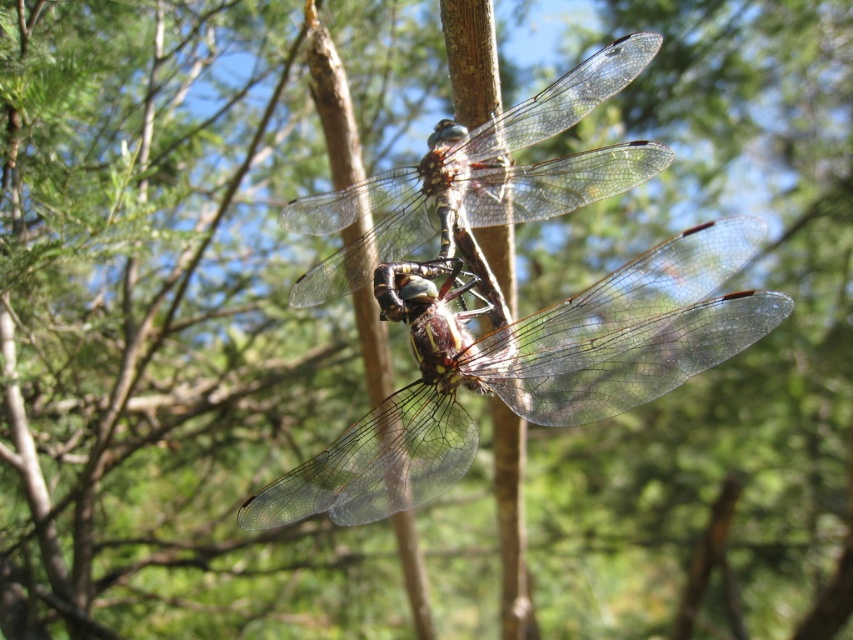
Question: Which point is farther to the camera?

Choices:
 (A) translucent glass dragonfly at center
 (B) transparent glass dragonfly at center

Answer: (B)

Question: Is the position of translucent glass dragonfly at center more distant than that of transparent glass dragonfly at center?

Choices:
 (A) yes
 (B) no

Answer: (B)

Question: Which object is closer to the camera taking this photo?

Choices:
 (A) transparent glass dragonfly at center
 (B) translucent glass dragonfly at center

Answer: (B)

Question: Can you confirm if translucent glass dragonfly at center is thinner than transparent glass dragonfly at center?

Choices:
 (A) yes
 (B) no

Answer: (B)

Question: Which point is closer to the camera taking this photo?

Choices:
 (A) (419, 340)
 (B) (637, 61)

Answer: (A)

Question: Can you confirm if translucent glass dragonfly at center is positioned above transparent glass dragonfly at center?

Choices:
 (A) yes
 (B) no

Answer: (B)